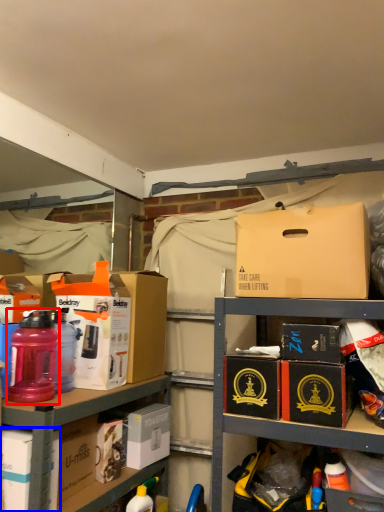
Question: Among these objects, which one is nearest to the camera, bottle (highlighted by a red box) or box (highlighted by a blue box)?

Choices:
 (A) bottle
 (B) box

Answer: (B)